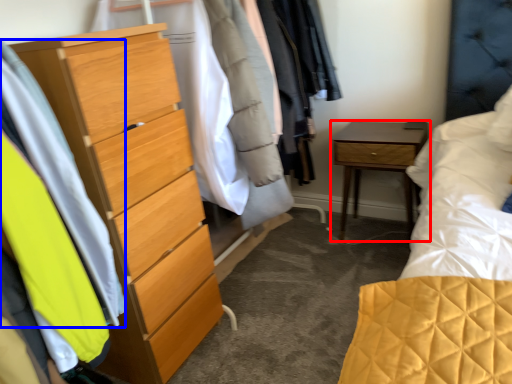
Question: Which of the following is the farthest to the observer, nightstand (highlighted by a red box) or clothing (highlighted by a blue box)?

Choices:
 (A) nightstand
 (B) clothing

Answer: (A)